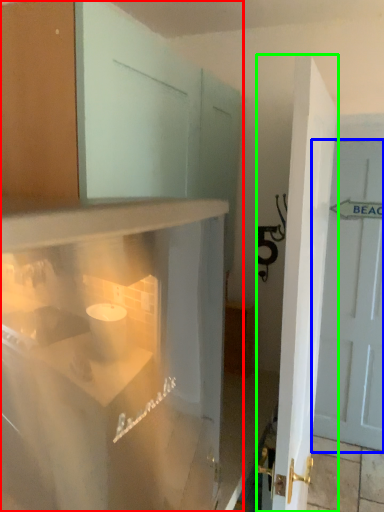
Question: Which is farther away from cabinetry (highlighted by a red box)? door (highlighted by a blue box) or door (highlighted by a green box)?

Choices:
 (A) door
 (B) door

Answer: (A)